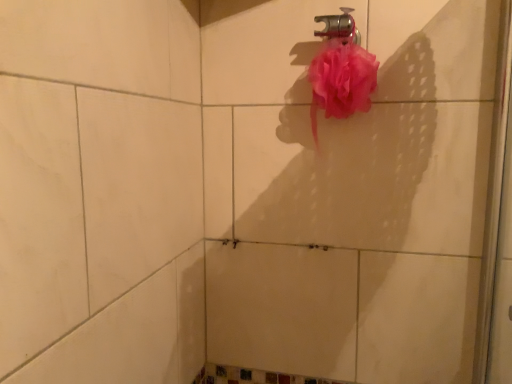
Question: From the image's perspective, is pink mesh sponge at upper right positioned above or below metallic faucet at upper center?

Choices:
 (A) below
 (B) above

Answer: (A)

Question: In terms of width, does pink mesh sponge at upper right look wider or thinner when compared to metallic faucet at upper center?

Choices:
 (A) thin
 (B) wide

Answer: (B)

Question: Is pink mesh sponge at upper right spatially inside metallic faucet at upper center, or outside of it?

Choices:
 (A) inside
 (B) outside

Answer: (B)

Question: Is metallic faucet at upper center in front of or behind pink mesh sponge at upper right in the image?

Choices:
 (A) behind
 (B) front

Answer: (A)

Question: Is metallic faucet at upper center spatially inside pink mesh sponge at upper right, or outside of it?

Choices:
 (A) inside
 (B) outside

Answer: (B)

Question: From their relative heights in the image, would you say metallic faucet at upper center is taller or shorter than pink mesh sponge at upper right?

Choices:
 (A) tall
 (B) short

Answer: (B)

Question: From a real-world perspective, relative to pink mesh sponge at upper right, is metallic faucet at upper center vertically above or below?

Choices:
 (A) above
 (B) below

Answer: (A)